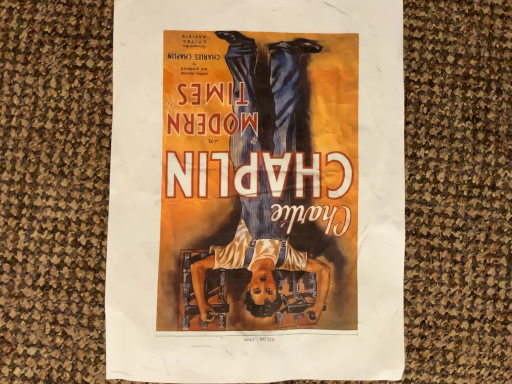
Locate an element on the screen. This screenshot has height=384, width=512. free location above matte paper poster at center (from a real-world perspective) is located at coordinates (251, 165).